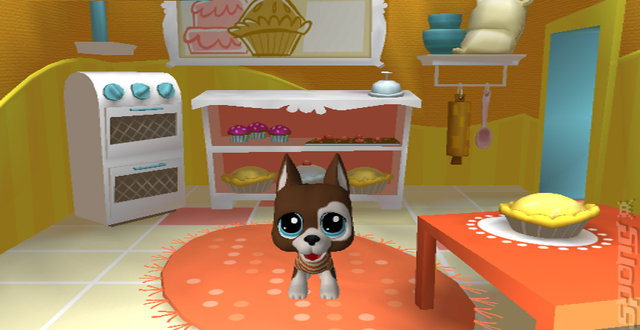
Where is `all three cupcakes on inner shelf`? The image size is (640, 330). all three cupcakes on inner shelf is located at coordinates (234, 137), (256, 123), (278, 132).